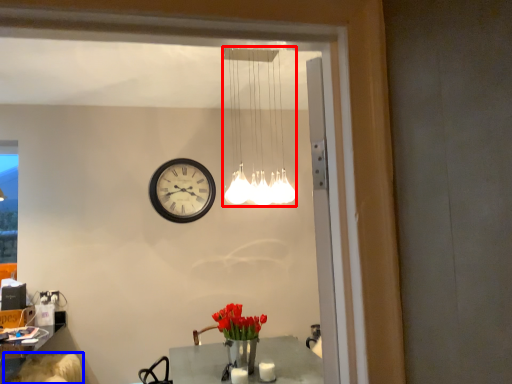
Question: Which object appears closest to the camera in this image, lamp (highlighted by a red box) or swivel chair (highlighted by a blue box)?

Choices:
 (A) lamp
 (B) swivel chair

Answer: (A)